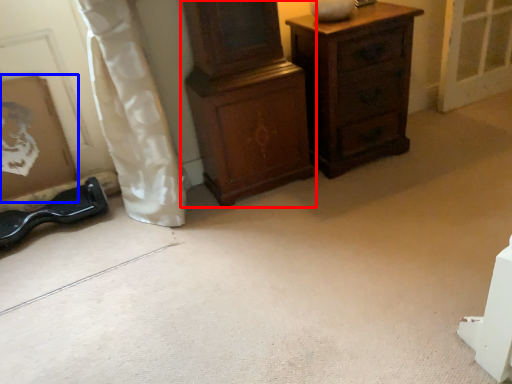
Question: Which object is closer to the camera taking this photo, chest of drawers (highlighted by a red box) or picture frame (highlighted by a blue box)?

Choices:
 (A) chest of drawers
 (B) picture frame

Answer: (A)